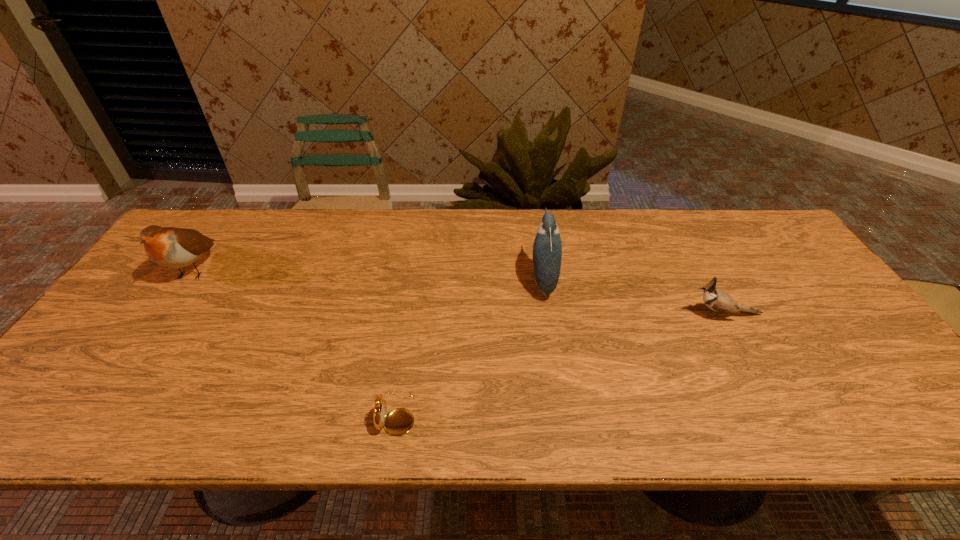
This screenshot has height=540, width=960. I want to click on the second bird from left to right, so click(547, 247).

At what (x,y) coordinates should I click in order to perform the action: click on the leftmost object. Please return your answer as a coordinate pair (x, y). The image size is (960, 540). Looking at the image, I should click on (172, 247).

This screenshot has height=540, width=960. In order to click on the second nearest object in this screenshot , I will do `click(717, 300)`.

At what (x,y) coordinates should I click in order to perform the action: click on the second shortest object. Please return your answer as a coordinate pair (x, y). Looking at the image, I should click on (717, 300).

Find the location of `pocket watch`. pocket watch is located at coordinates (399, 421).

You are a GUI agent. You are given a task and a screenshot of the screen. Output one action in this format:
    pyautogui.click(x=<x>, y=<y>)
    Task: Click on the second object from left to right
    
    Given the screenshot: What is the action you would take?
    pyautogui.click(x=399, y=421)

Identify the location of free space located 0.230m at the tip of the second object from right to left's beak. (448, 280).

Where is `vacant space located 0.060m at the tip of the second object from right to left's beak`? Image resolution: width=960 pixels, height=540 pixels. vacant space located 0.060m at the tip of the second object from right to left's beak is located at coordinates (508, 280).

The width and height of the screenshot is (960, 540). I want to click on vacant space located at the tip of the second object from right to left's beak, so click(x=389, y=280).

This screenshot has width=960, height=540. I want to click on vacant space located at the face of the leftmost bird, so click(98, 406).